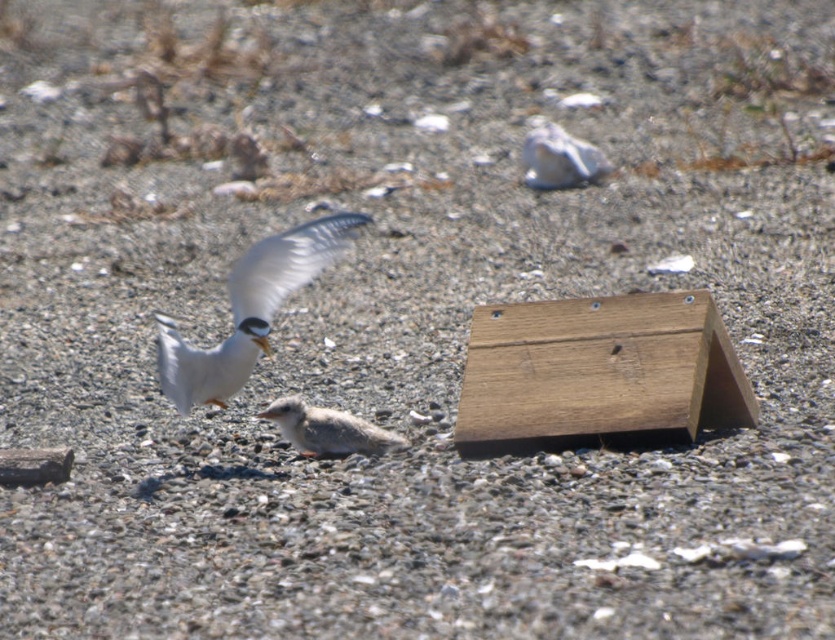
Who is positioned more to the left, brown wooden box at center or white feathered bird at center?

From the viewer's perspective, white feathered bird at center appears more on the left side.

Does brown wooden box at center appear on the left side of white feathered bird at center?

In fact, brown wooden box at center is to the right of white feathered bird at center.

Find the location of a particular element. brown wooden box at center is located at coordinates (598, 374).

Locate an element on the screen. brown wooden box at center is located at coordinates (598, 374).

Between brown wooden box at center and gray downy chick at center, which one appears on the right side from the viewer's perspective?

From the viewer's perspective, brown wooden box at center appears more on the right side.

Is brown wooden box at center above gray downy chick at center?

Yes.

Is point (591, 380) closer to camera compared to point (317, 416)?

Yes, point (591, 380) is closer to viewer.

Image resolution: width=835 pixels, height=640 pixels. What are the coordinates of `brown wooden box at center` in the screenshot? It's located at (598, 374).

Who is positioned more to the right, gray downy chick at center or white matte rock at upper center?

Positioned to the right is white matte rock at upper center.

Does gray downy chick at center appear under white matte rock at upper center?

Yes.

Locate an element on the screen. The width and height of the screenshot is (835, 640). gray downy chick at center is located at coordinates (327, 429).

Find the location of a particular element. This screenshot has width=835, height=640. gray downy chick at center is located at coordinates (327, 429).